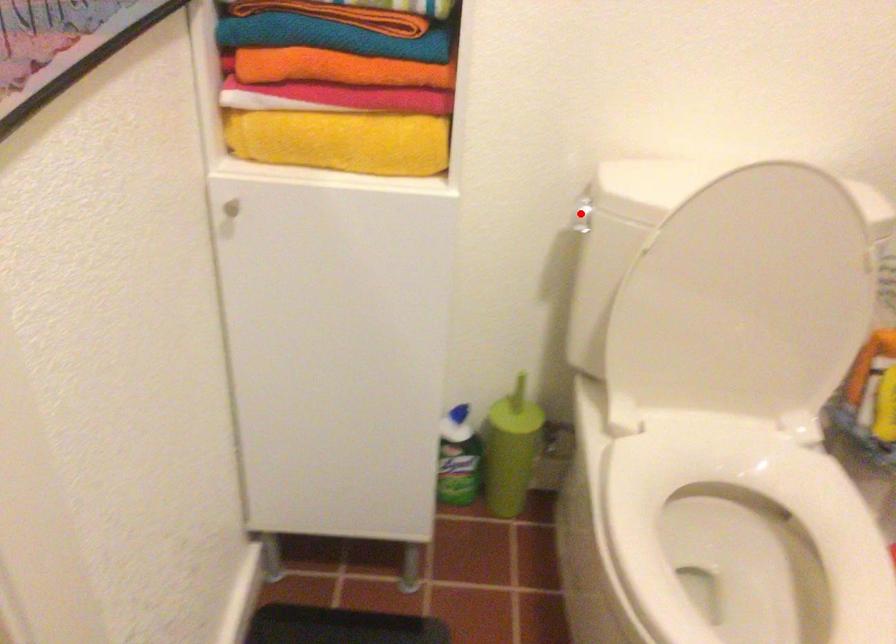
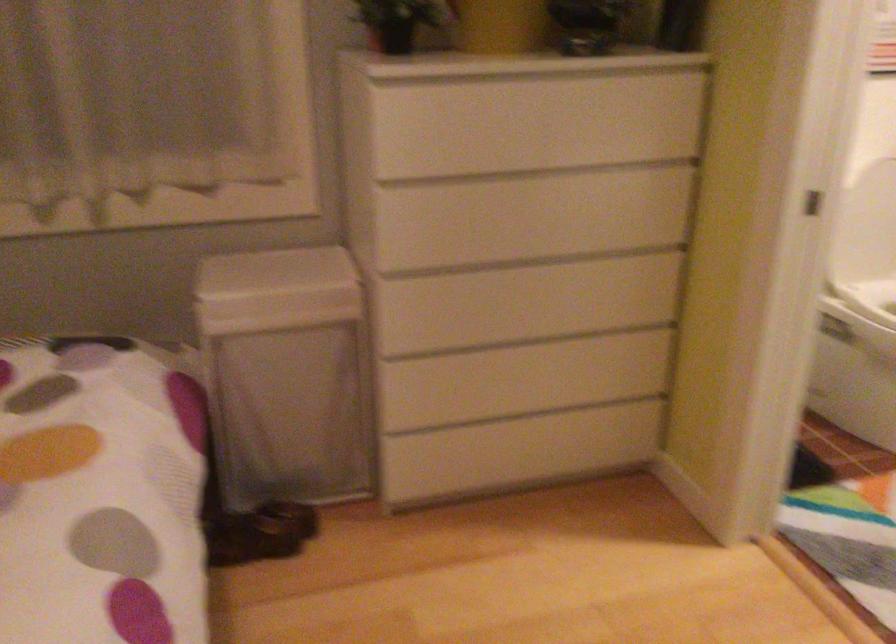
Question: I am providing you with two images of the same scene from different viewpoints. A red point is marked on the first image. Can you still see the location of the red point in image 2?

Choices:
 (A) Yes
 (B) No

Answer: (B)